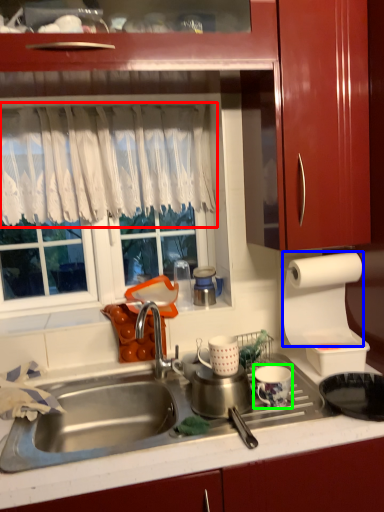
Question: Based on their relative distances, which object is farther from curtain (highlighted by a red box)? Choose from paper towel (highlighted by a blue box) and tableware (highlighted by a green box).

Choices:
 (A) paper towel
 (B) tableware

Answer: (B)